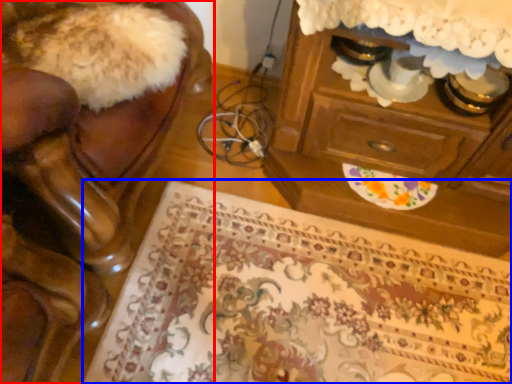
Question: Which point is closer to the camera, furniture (highlighted by a red box) or mat (highlighted by a blue box)?

Choices:
 (A) furniture
 (B) mat

Answer: (A)